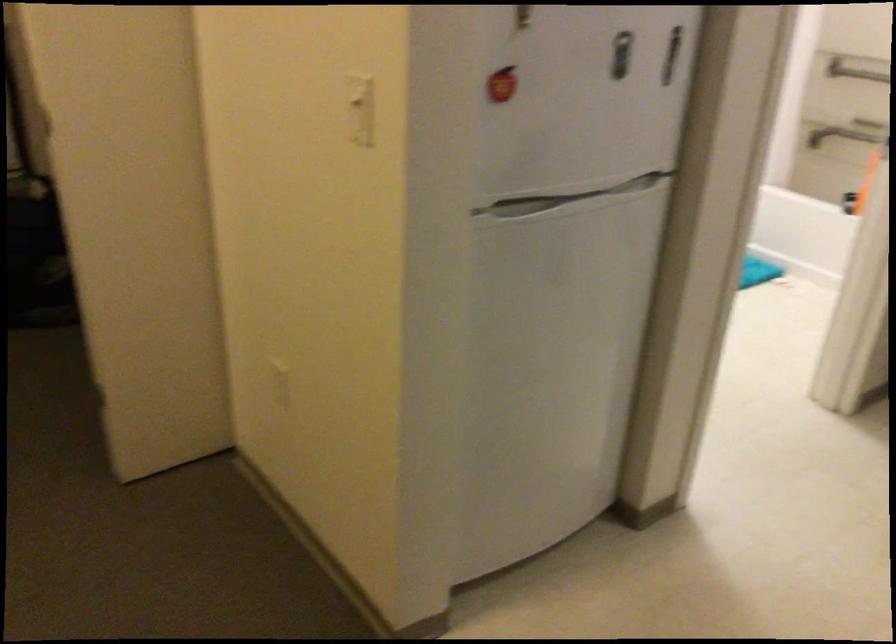
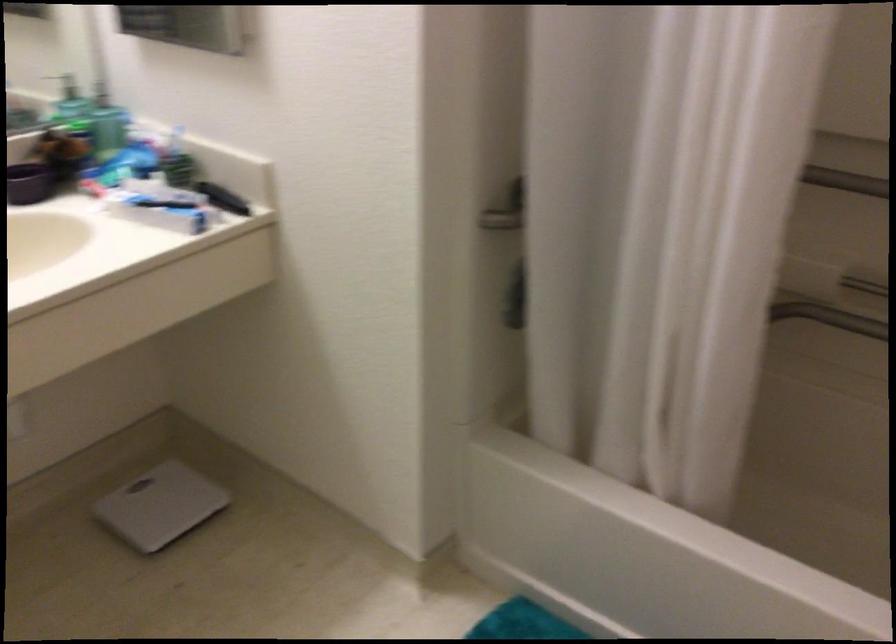
Question: The images are taken continuously from a first-person perspective. In which direction are you moving?

Choices:
 (A) Left
 (B) Right
 (C) Forward
 (D) Backward

Answer: (C)